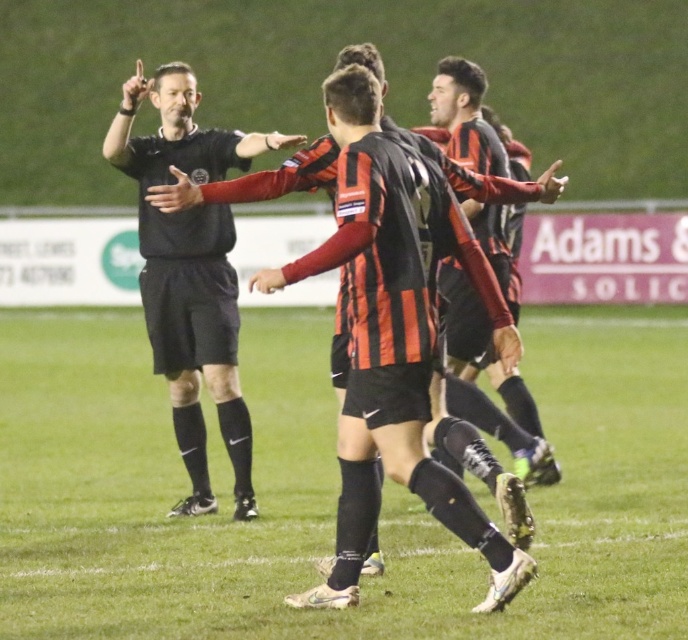
Which of these two, green grass at center or black matte referee at center, stands shorter?

green grass at center is shorter.

Does green grass at center have a greater width compared to black matte referee at center?

Yes.

Does point (184, 589) come in front of point (191, 288)?

That is True.

Where is `green grass at center`? green grass at center is located at coordinates (325, 490).

Is green grass at center positioned in front of black and orange striped jersey at center?

Yes, it is.

Is point (250, 552) farther from camera compared to point (502, 275)?

That is False.

Where is `green grass at center`? green grass at center is located at coordinates (325, 490).

Is green grass at center shorter than black striped jersey at center?

Indeed, green grass at center has a lesser height compared to black striped jersey at center.

Is green grass at center closer to camera compared to black striped jersey at center?

No, it is not.

Identify the location of green grass at center. The height and width of the screenshot is (640, 688). [325, 490].

You are a GUI agent. You are given a task and a screenshot of the screen. Output one action in this format:
    pyautogui.click(x=<x>, y=<y>)
    Task: Click on the green grass at center
    This screenshot has height=640, width=688.
    Given the screenshot: What is the action you would take?
    pyautogui.click(x=325, y=490)